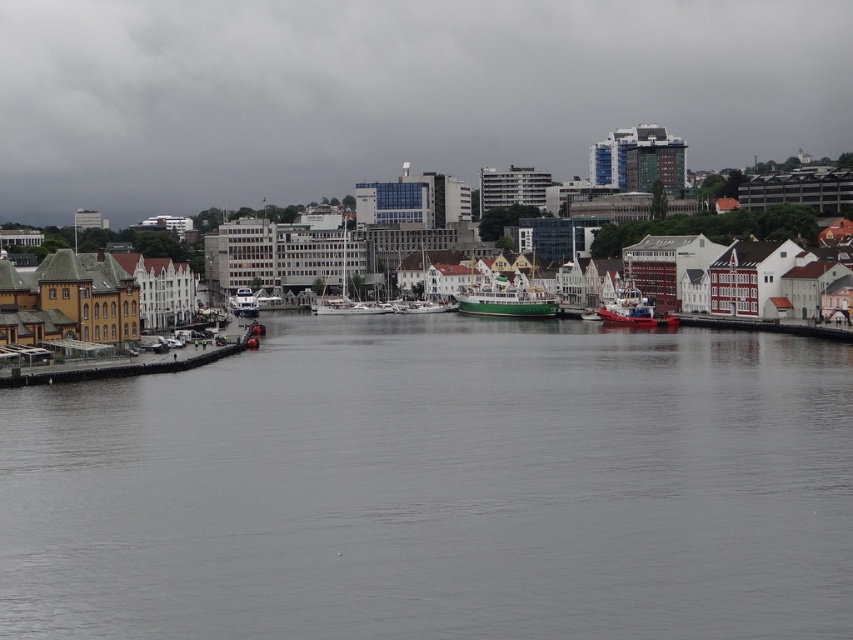
You are a delivery drone that needs to fly from the wooden dock at lower left to the gray water at center. What is the minimum distance you must cover to reach your destination?

The minimum distance between the wooden dock at lower left and the gray water at center is 31.95 meters.

You are standing at the wooden dock at lower left and want to reach the gray water at center. Which direction should you move to get there?

You should move to the right to reach the gray water at center since it is located to the right of the wooden dock at lower left.

You are standing at the center of the image and want to walk to the wooden dock at lower left. Which direction should you head?

You should head to the left direction to reach the wooden dock at lower left.